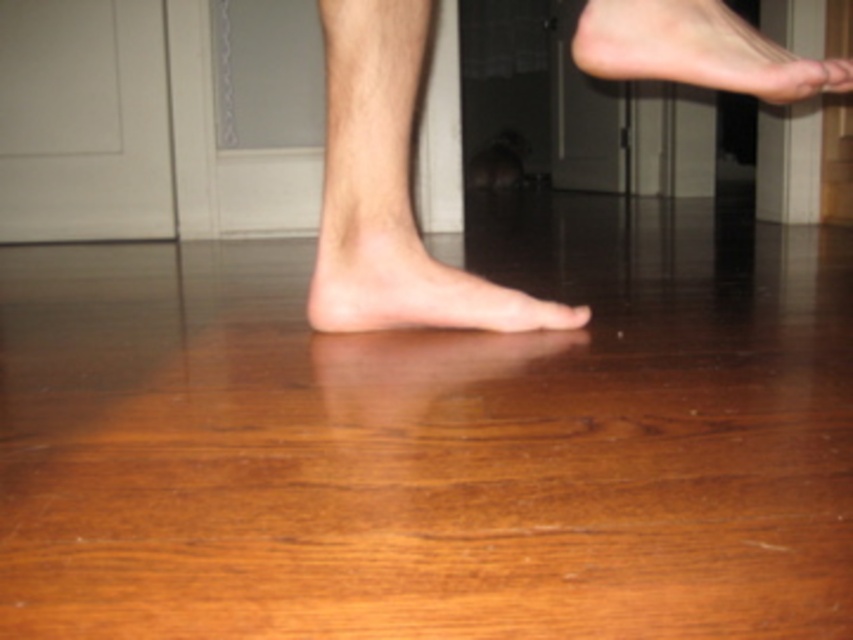
You are a photographer setting up a shoot in the room. You notice the two skinny barefoot at upper right and skinny barefoot at center. Which foot is positioned higher up in the frame?

The skinny barefoot at upper right is positioned higher up in the frame than the skinny barefoot at center.

You are designing a slipper that needs to fit over the skin and foot shown. Based on the image, will the slipper need to be wider for the hairless skin at center or the skinny barefoot at center?

The slipper will need to be wider for the skinny barefoot at center since the hairless skin at center has a smaller width.

You are a photographer adjusting the lighting in a room. You notice the hairless skin at center and the skinny barefoot at center in your shot. Which object is positioned higher in the frame?

The hairless skin at center is above the skinny barefoot at center, so it is positioned higher in the frame.